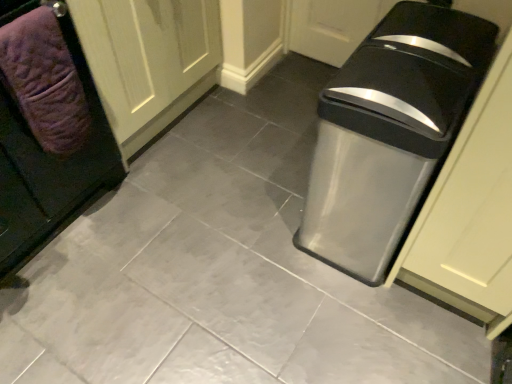
Question: Is metallic gray trash can at right located outside white wood door at upper left?

Choices:
 (A) no
 (B) yes

Answer: (B)

Question: Would you consider metallic gray trash can at right to be distant from white wood door at upper left?

Choices:
 (A) no
 (B) yes

Answer: (A)

Question: Can you confirm if metallic gray trash can at right is wider than white wood door at upper left?

Choices:
 (A) yes
 (B) no

Answer: (B)

Question: Considering the relative sizes of metallic gray trash can at right and white wood door at upper left in the image provided, is metallic gray trash can at right shorter than white wood door at upper left?

Choices:
 (A) yes
 (B) no

Answer: (A)

Question: From a real-world perspective, is metallic gray trash can at right located higher than white wood door at upper left?

Choices:
 (A) yes
 (B) no

Answer: (A)

Question: Considering their positions, is purple textured towel at left located in front of or behind white wood door at upper left?

Choices:
 (A) front
 (B) behind

Answer: (A)

Question: Considering the positions of purple textured towel at left and white wood door at upper left in the image, is purple textured towel at left wider or thinner than white wood door at upper left?

Choices:
 (A) wide
 (B) thin

Answer: (B)

Question: From a real-world perspective, is purple textured towel at left physically located above or below white wood door at upper left?

Choices:
 (A) below
 (B) above

Answer: (B)

Question: Is purple textured towel at left bigger or smaller than white wood door at upper left?

Choices:
 (A) small
 (B) big

Answer: (A)

Question: From a real-world perspective, is purple textured towel at left above or below metallic gray trash can at right?

Choices:
 (A) above
 (B) below

Answer: (A)

Question: Is purple textured towel at left inside the boundaries of metallic gray trash can at right, or outside?

Choices:
 (A) outside
 (B) inside

Answer: (A)

Question: Looking at their shapes, would you say purple textured towel at left is wider or thinner than metallic gray trash can at right?

Choices:
 (A) thin
 (B) wide

Answer: (A)

Question: Is purple textured towel at left bigger or smaller than metallic gray trash can at right?

Choices:
 (A) small
 (B) big

Answer: (A)

Question: Is point (33, 124) positioned closer to the camera than point (446, 61)?

Choices:
 (A) closer
 (B) farther

Answer: (B)

Question: Visually, is purple quilted towel at left positioned to the left or to the right of metallic gray trash can at right?

Choices:
 (A) left
 (B) right

Answer: (A)